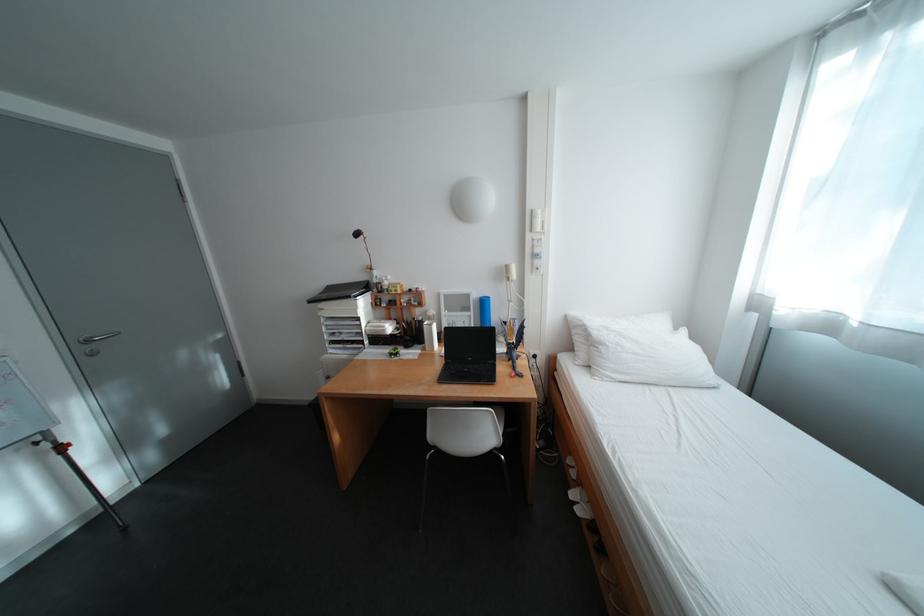
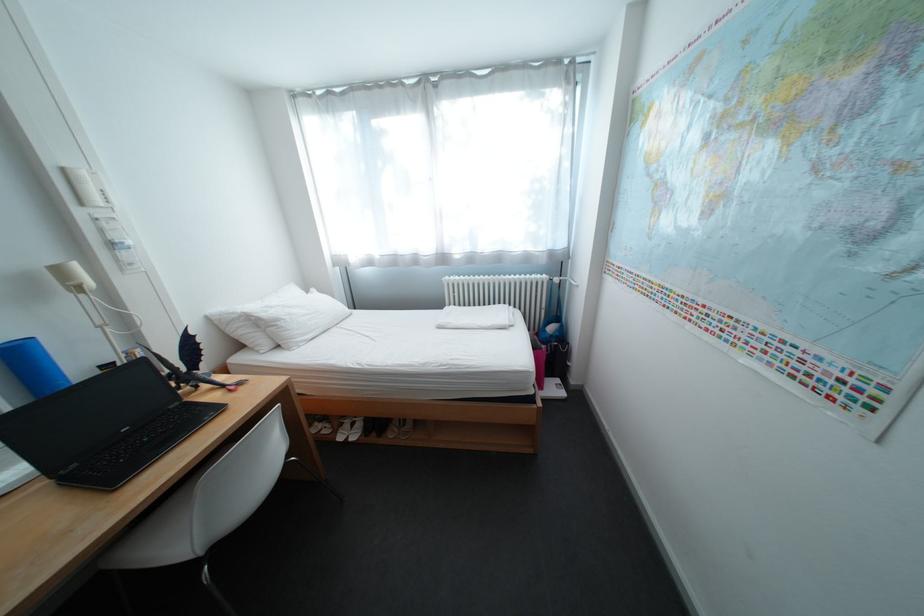
Locate, in the second image, the point that corresponds to pixel 519 269 in the first image.

(71, 272)